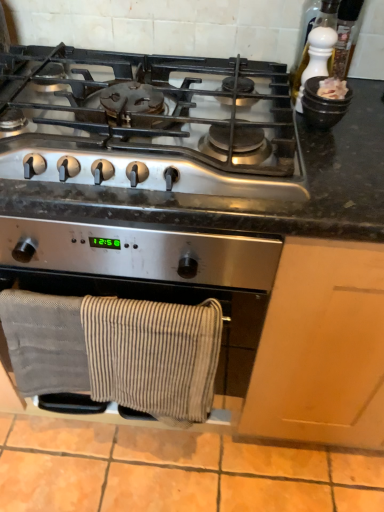
In order to click on vacant space underneath gray cotton towels at lower center (from a real-world perspective) in this screenshot , I will do [x=128, y=465].